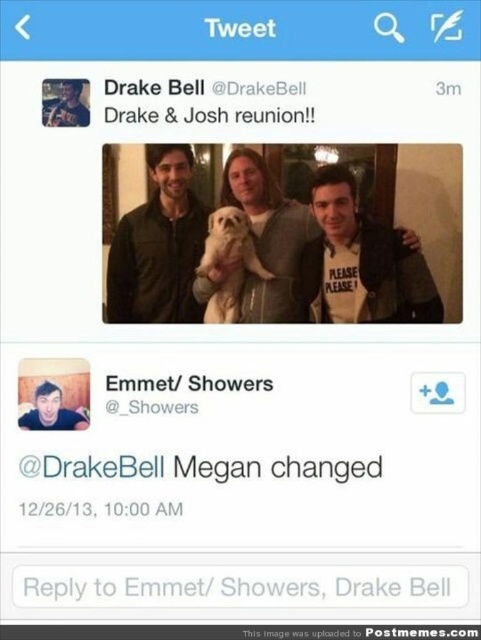
Question: Which object appears closest to the camera in this image?

Choices:
 (A) matte black jacket at center
 (B) white fur dog at center
 (C) matte green jacket at center
 (D) matte skin face at center

Answer: (D)

Question: Can you confirm if matte black jacket at center is positioned to the left of matte green jacket at center?

Choices:
 (A) no
 (B) yes

Answer: (A)

Question: Is matte green jacket at center below white fur dog at center?

Choices:
 (A) no
 (B) yes

Answer: (A)

Question: Does matte black jacket at center appear under matte green jacket at center?

Choices:
 (A) yes
 (B) no

Answer: (A)

Question: Which point is farther to the camera?

Choices:
 (A) (219, 216)
 (B) (50, 417)

Answer: (A)

Question: Which object is farther from the camera taking this photo?

Choices:
 (A) white fur dog at center
 (B) matte skin face at center
 (C) matte green jacket at center

Answer: (A)